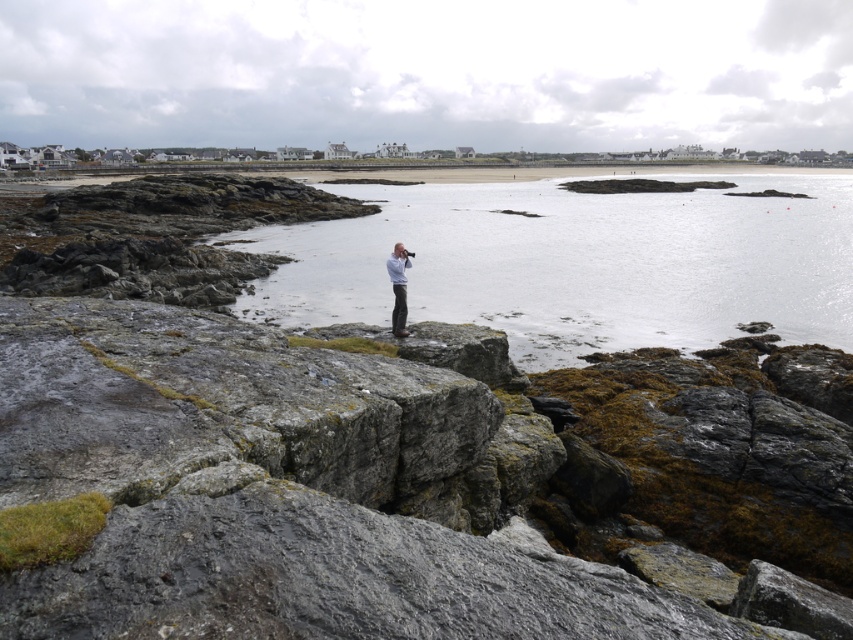
You are a photographer trying to capture the gray rock at center and the white matte shirt at center in the same frame. Based on their sizes in the image, which object will appear larger in your photo?

The gray rock at center will appear larger in the photo since it is bigger than the white matte shirt at center according to the description.